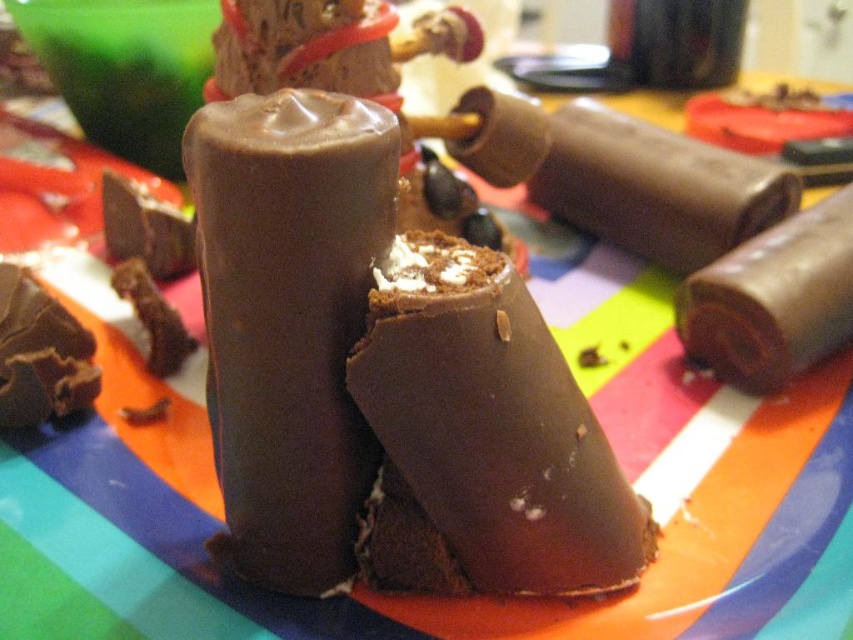
Which of these two, chocolate matte at center or chocolatesmoothcandy at center, stands taller?

chocolate matte at center is taller.

Is chocolate matte at center to the left of chocolatesmoothcandy at center from the viewer's perspective?

Indeed, chocolate matte at center is positioned on the left side of chocolatesmoothcandy at center.

What do you see at coordinates (289, 321) in the screenshot? The height and width of the screenshot is (640, 853). I see `chocolate matte at center` at bounding box center [289, 321].

What are the coordinates of `chocolate matte at center` in the screenshot? It's located at pyautogui.click(x=289, y=321).

Is chocolate matte at center shorter than chocolate matte at right?

No, chocolate matte at center is not shorter than chocolate matte at right.

Based on the photo, who is positioned more to the right, chocolate matte at center or chocolate matte at right?

chocolate matte at right

Is point (201, 212) positioned in front of point (677, 314)?

Yes, it is.

This screenshot has height=640, width=853. I want to click on chocolate matte at center, so click(289, 321).

Can you confirm if chocolatesmoothcandy at center is taller than chocolate matte at upper right?

Indeed, chocolatesmoothcandy at center has a greater height compared to chocolate matte at upper right.

Does chocolatesmoothcandy at center appear over chocolate matte at upper right?

Incorrect, chocolatesmoothcandy at center is not positioned above chocolate matte at upper right.

Between point (372, 563) and point (563, 131), which one is positioned behind?

The point (563, 131) is behind.

You are a GUI agent. You are given a task and a screenshot of the screen. Output one action in this format:
    pyautogui.click(x=<x>, y=<y>)
    Task: Click on the chocolatesmoothcandy at center
    
    Given the screenshot: What is the action you would take?
    pyautogui.click(x=483, y=438)